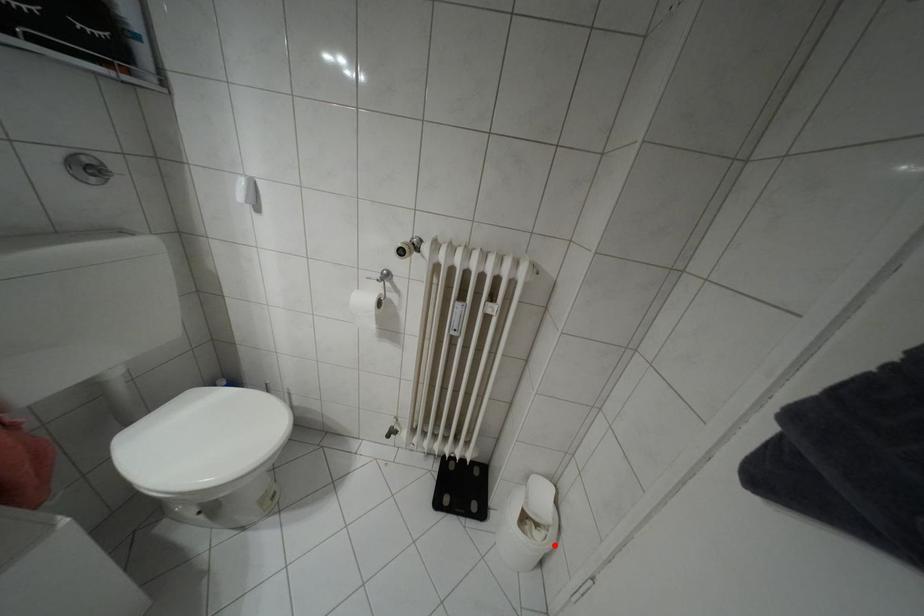
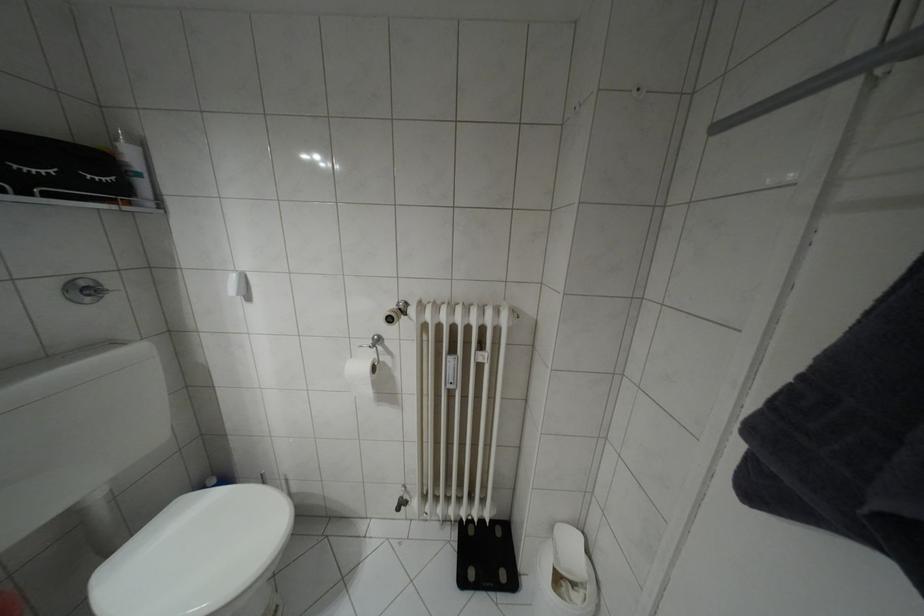
Question: I am providing you with two images of the same scene from different viewpoints. Given a red point in image1, look at the same physical point in image2. Is it:

Choices:
 (A) Closer to the viewpoint
 (B) Farther from the viewpoint

Answer: (A)